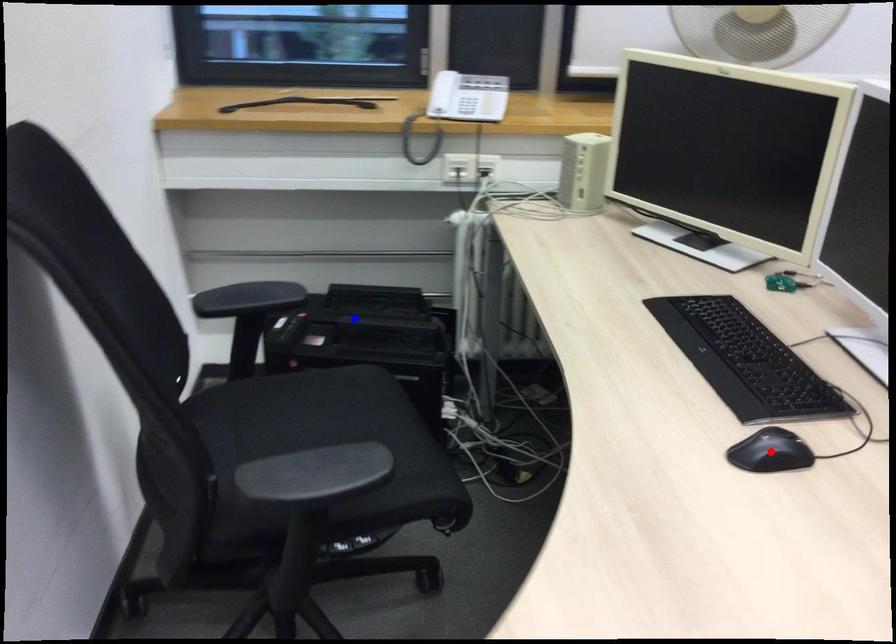
Question: In the image, two points are highlighted. Which point is nearer to the camera? Reply with the corresponding letter.

Choices:
 (A) blue point
 (B) red point

Answer: (B)